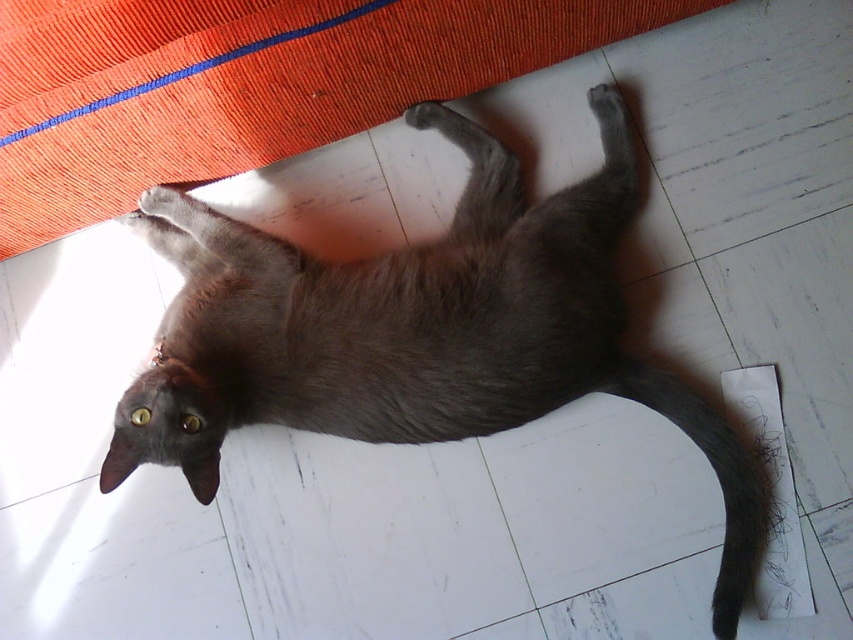
Based on the scene description, where is the gray fur cat at center located in terms of coordinates?

The gray fur cat at center is located at coordinates approximately 0.520 in the x axis and 0.491 in the y axis.

You are a photographer trying to capture the gray fur cat at center and the gray fur tail at lower right in a single shot. Since the camera can only focus on one subject at a time, which subject should you focus on to ensure the other remains in the background?

The gray fur cat at center is positioned over gray fur tail at lower right, so focusing on the gray fur cat at center will keep the gray fur tail at lower right in the background.

You are a photographer trying to capture the gray fur cat at center and the gray fur tail at lower right in a single frame. Which one should you focus on to ensure the cat is the main subject?

You should focus on the gray fur cat at center because it is bigger than the gray fur tail at lower right, making it the main subject.